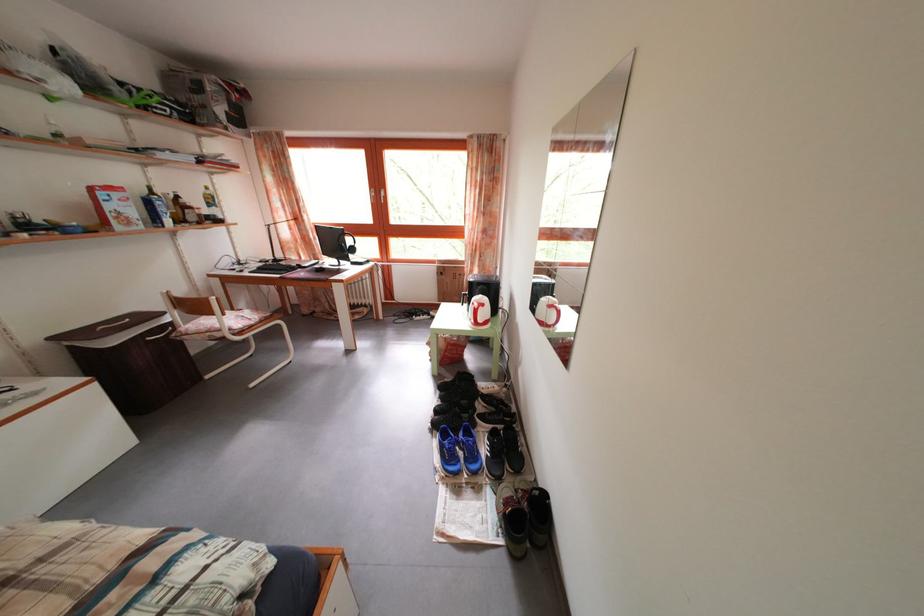
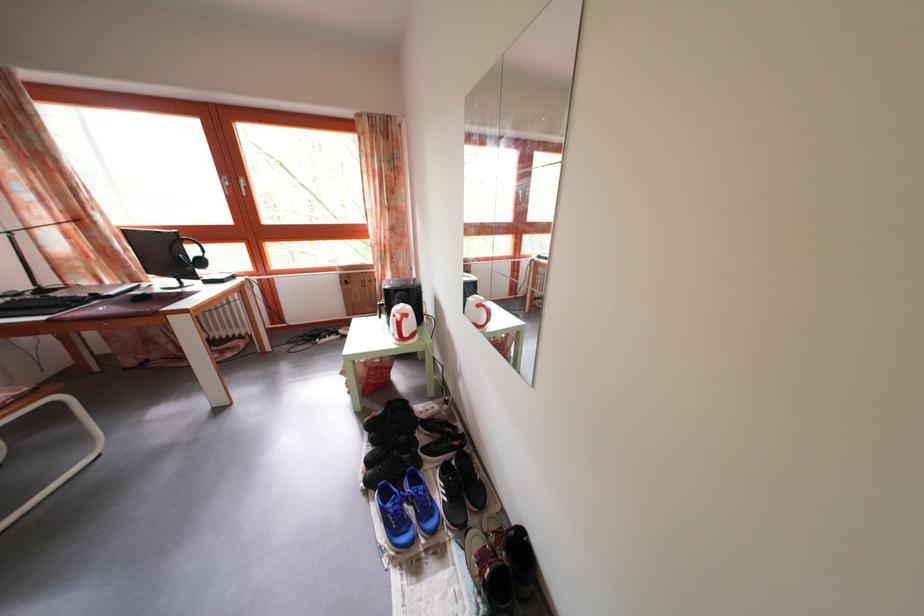
Question: The camera is either moving clockwise (left) or counter-clockwise (right) around the object. The first image is from the beginning of the video and the second image is from the end. Is the camera moving left or right when shooting the video?

Choices:
 (A) Left
 (B) Right

Answer: (A)